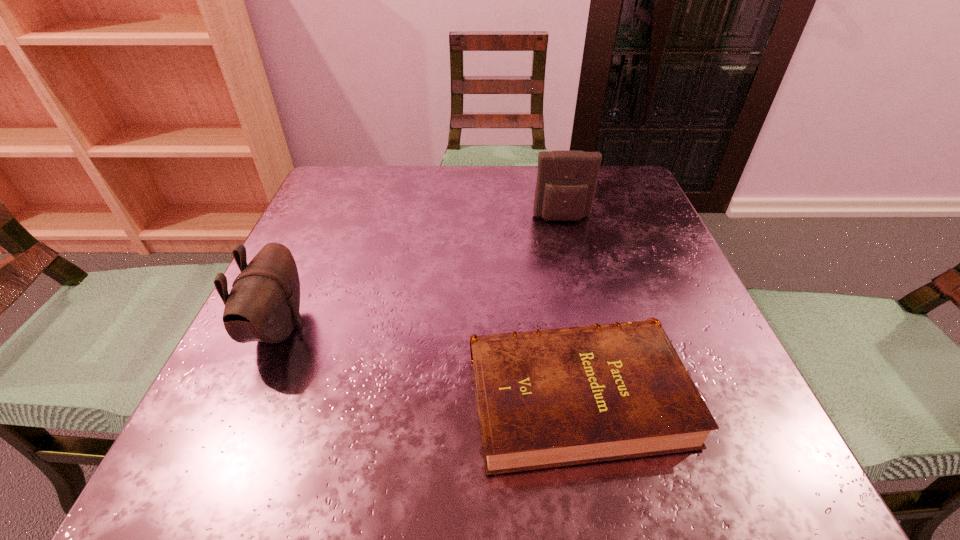
The width and height of the screenshot is (960, 540). I want to click on object that is the second closest to the leftmost object, so click(x=566, y=180).

Where is `object that is the second closest one to the hardback book`? The height and width of the screenshot is (540, 960). object that is the second closest one to the hardback book is located at coordinates (566, 180).

What are the coordinates of `free space that satisfies the following two spatial constraints: 1. with the flap open on the hardback book; 2. on the left side of the nearer pouch` in the screenshot? It's located at (248, 396).

The image size is (960, 540). What are the coordinates of `free space that satisfies the following two spatial constraints: 1. with the flap open on the leftmost object; 2. on the left side of the hardback book` in the screenshot? It's located at (248, 396).

Locate an element on the screen. This screenshot has height=540, width=960. blank area in the image that satisfies the following two spatial constraints: 1. with an open flap on the farthest object; 2. with the flap open on the left pouch is located at coordinates [588, 327].

You are a GUI agent. You are given a task and a screenshot of the screen. Output one action in this format:
    pyautogui.click(x=<x>, y=<y>)
    Task: Click on the vacant region that satisfies the following two spatial constraints: 1. with the flap open on the left pouch; 2. on the left side of the hardback book
    Image resolution: width=960 pixels, height=540 pixels.
    Given the screenshot: What is the action you would take?
    pyautogui.click(x=248, y=396)

This screenshot has width=960, height=540. Find the location of `vacant position in the image that satisfies the following two spatial constraints: 1. with the flap open on the leftmost object; 2. on the back side of the shortest object`. vacant position in the image that satisfies the following two spatial constraints: 1. with the flap open on the leftmost object; 2. on the back side of the shortest object is located at coordinates (248, 396).

At what (x,y) coordinates should I click in order to perform the action: click on free space that satisfies the following two spatial constraints: 1. with an open flap on the right pouch; 2. with the flap open on the nearer pouch. Please return your answer as a coordinate pair (x, y). Looking at the image, I should click on (588, 327).

Identify the location of vacant space that satisfies the following two spatial constraints: 1. on the back side of the hardback book; 2. with the flap open on the leftmost object. This screenshot has height=540, width=960. (564, 327).